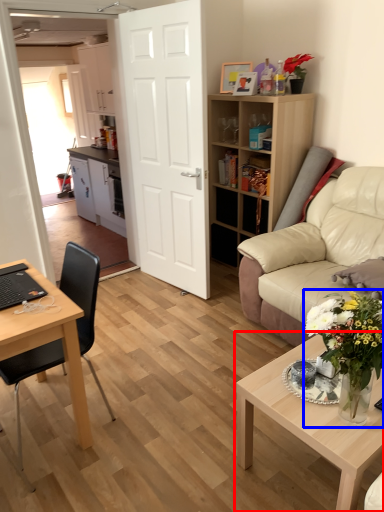
Question: Which object appears closest to the camera in this image, coffee table (highlighted by a red box) or houseplant (highlighted by a blue box)?

Choices:
 (A) coffee table
 (B) houseplant

Answer: (B)